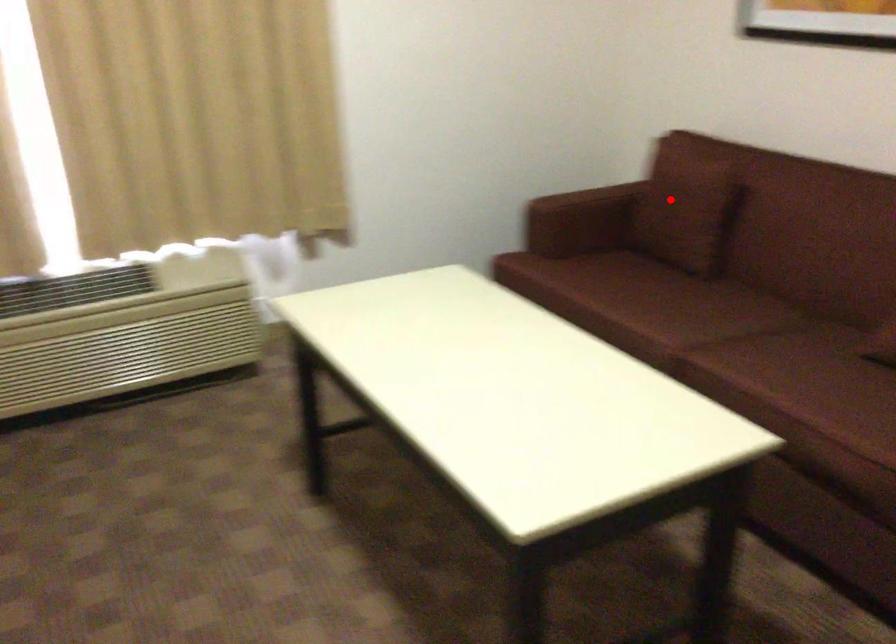
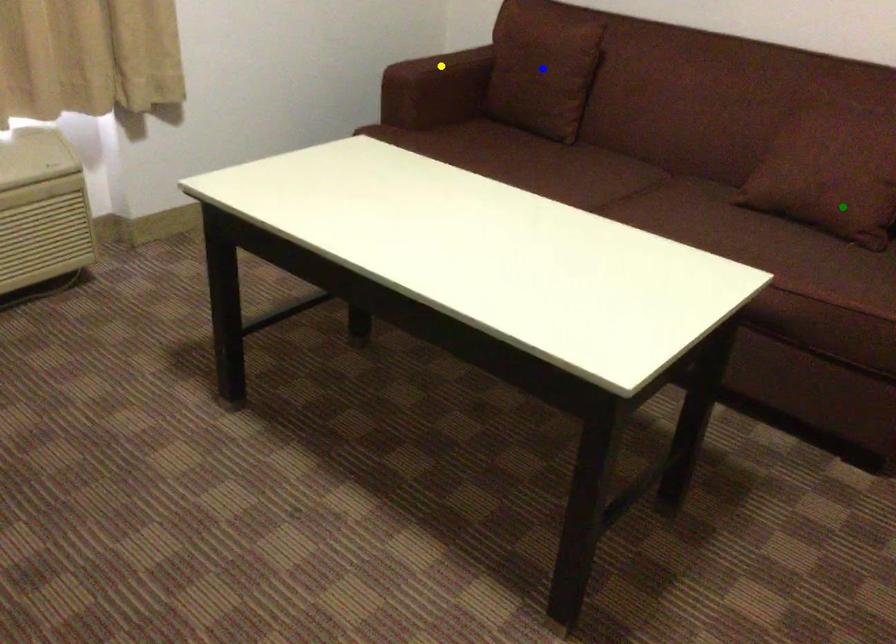
Question: I am providing you with two images of the same scene from different viewpoints. A red point is marked on the first image. You are given multiple points on the second image. Which mark in image 2 goes with the point in image 1?

Choices:
 (A) yellow point
 (B) green point
 (C) blue point

Answer: (C)